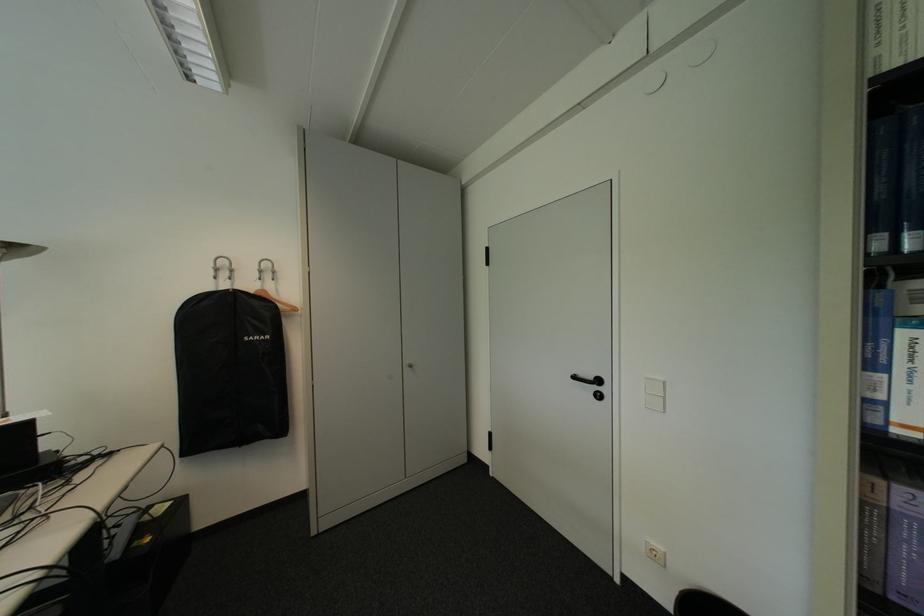
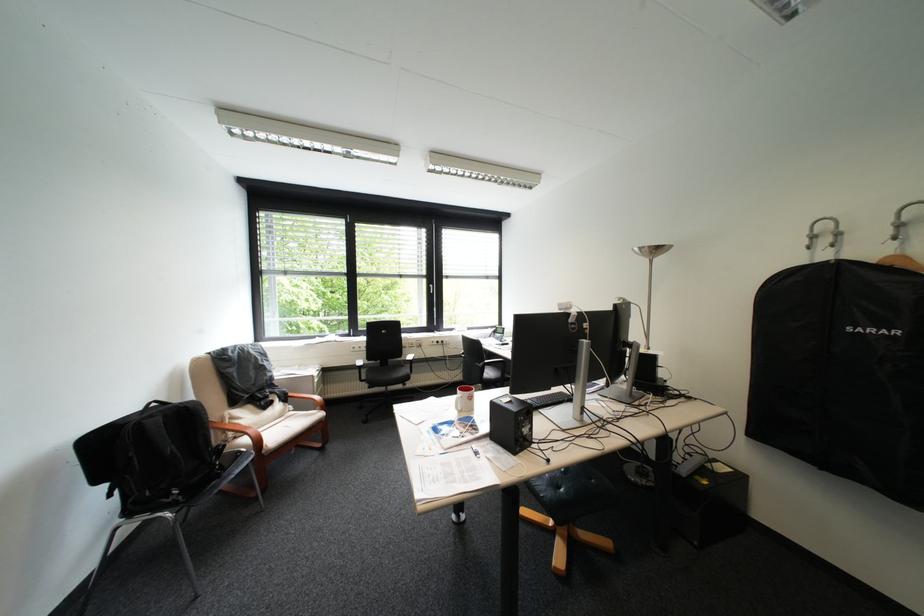
In the second image, find the point that corresponds to [263,293] in the first image.

(886, 262)